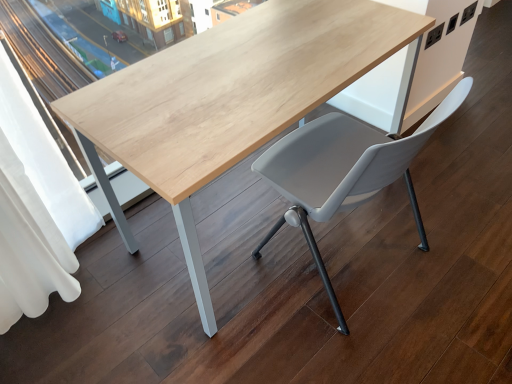
The image size is (512, 384). I want to click on natural wood table at center, so (x=227, y=100).

How much distance is there between natural wood table at center and white fabric curtain at left?

natural wood table at center and white fabric curtain at left are 20.80 inches apart.

At what (x,y) coordinates should I click in order to perform the action: click on table lying above the white fabric curtain at left (from the image's perspective). Please return your answer as a coordinate pair (x, y). The height and width of the screenshot is (384, 512). Looking at the image, I should click on (227, 100).

Does point (372, 63) come behind point (40, 312)?

No, it is in front of (40, 312).

From a real-world perspective, is matte gray plastic chair at center physically below natural wood table at center?

No, from a real-world perspective, matte gray plastic chair at center is not beneath natural wood table at center.

Is matte gray plastic chair at center in front of or behind natural wood table at center in the image?

Clearly, matte gray plastic chair at center is behind natural wood table at center.

The height and width of the screenshot is (384, 512). In order to click on chair below the natural wood table at center (from the image's perspective) in this screenshot , I will do `click(344, 171)`.

Is white fabric curtain at left with natural wood table at center?

No, white fabric curtain at left is not with natural wood table at center.

In terms of height, does white fabric curtain at left look taller or shorter compared to natural wood table at center?

white fabric curtain at left is taller than natural wood table at center.

Does white fabric curtain at left have a greater width compared to natural wood table at center?

In fact, white fabric curtain at left might be narrower than natural wood table at center.

Which object is more forward, white fabric curtain at left or natural wood table at center?

white fabric curtain at left is more forward.

Considering the points (342, 148) and (13, 282), which point is in front, point (342, 148) or point (13, 282)?

Point (13, 282)

Is matte gray plastic chair at center taller than white fabric curtain at left?

In fact, matte gray plastic chair at center may be shorter than white fabric curtain at left.

From the image's perspective, is matte gray plastic chair at center on top of white fabric curtain at left?

Yes.

Is white fabric curtain at left smaller than matte gray plastic chair at center?

Correct, white fabric curtain at left occupies less space than matte gray plastic chair at center.

Is point (44, 300) positioned behind point (392, 142)?

Yes, point (44, 300) is farther from viewer.

Which of these two, white fabric curtain at left or matte gray plastic chair at center, stands taller?

With more height is white fabric curtain at left.

Measure the distance between white fabric curtain at left and matte gray plastic chair at center.

white fabric curtain at left is 35.26 inches from matte gray plastic chair at center.

Is natural wood table at center turned away from matte gray plastic chair at center?

natural wood table at center does not have its back to matte gray plastic chair at center.

Based on their sizes in the image, would you say natural wood table at center is bigger or smaller than matte gray plastic chair at center?

In the image, natural wood table at center appears to be larger than matte gray plastic chair at center.

How many degrees apart are the facing directions of natural wood table at center and matte gray plastic chair at center?

The angular difference between natural wood table at center and matte gray plastic chair at center is 167 degrees.

From a real-world perspective, between natural wood table at center and matte gray plastic chair at center, who is vertically lower?

natural wood table at center is physically lower.

The width and height of the screenshot is (512, 384). Find the location of `table that is on the right side of white fabric curtain at left`. table that is on the right side of white fabric curtain at left is located at coordinates (227, 100).

This screenshot has height=384, width=512. Find the location of `table directly beneath the matte gray plastic chair at center (from a real-world perspective)`. table directly beneath the matte gray plastic chair at center (from a real-world perspective) is located at coordinates (227, 100).

Based on their spatial positions, is natural wood table at center or matte gray plastic chair at center closer to white fabric curtain at left?

natural wood table at center lies closer to white fabric curtain at left than the other object.

From the image, which object appears to be nearer to matte gray plastic chair at center, white fabric curtain at left or natural wood table at center?

Among the two, natural wood table at center is located nearer to matte gray plastic chair at center.

From the picture: Based on their spatial positions, is natural wood table at center or white fabric curtain at left closer to matte gray plastic chair at center?

natural wood table at center is closer to matte gray plastic chair at center.

Looking at the image, which one is located further to natural wood table at center, matte gray plastic chair at center or white fabric curtain at left?

The object further to natural wood table at center is white fabric curtain at left.

Consider the image. Estimate the real-world distances between objects in this image. Which object is further from white fabric curtain at left, matte gray plastic chair at center or natural wood table at center?

The object further to white fabric curtain at left is matte gray plastic chair at center.

Estimate the real-world distances between objects in this image. Which object is further from natural wood table at center, white fabric curtain at left or matte gray plastic chair at center?

The object further to natural wood table at center is white fabric curtain at left.

I want to click on chair between white fabric curtain at left and natural wood table at center in the horizontal direction, so click(x=344, y=171).